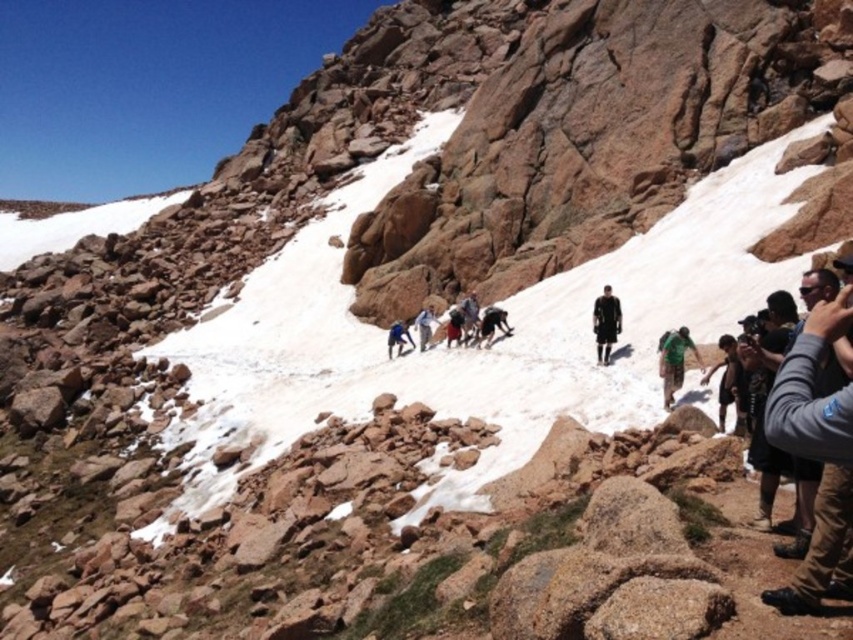
Does gray fabric jacket at lower right have a lesser width compared to green fabric backpack at center?

No.

Who is more forward, (840, 401) or (682, 376)?

Point (840, 401) is in front.

Does point (802, 593) lie in front of point (679, 380)?

Yes.

What are the coordinates of `gray fabric jacket at lower right` in the screenshot? It's located at (817, 454).